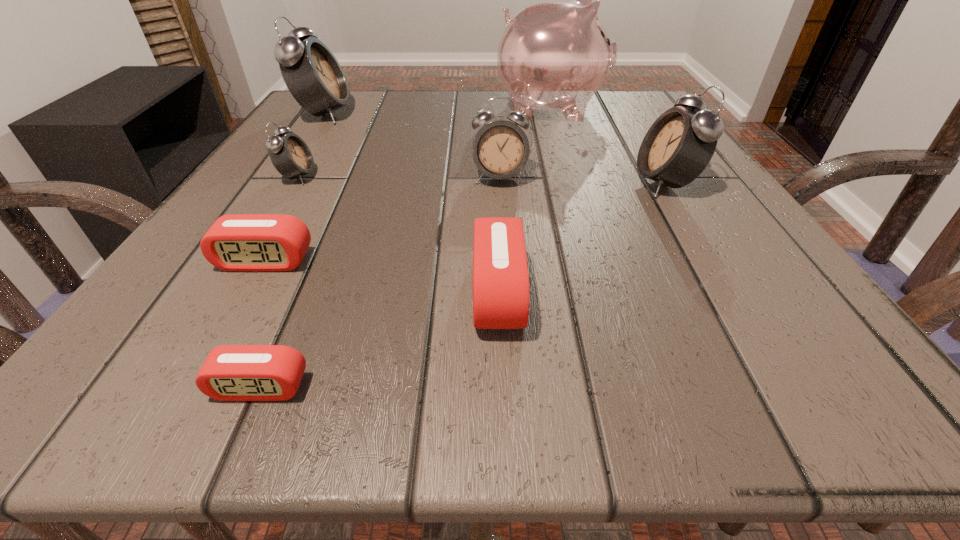
At what (x,y) coordinates should I click in order to perform the action: click on free space between the second shortest alarm clock and the nearest alarm clock. Please return your answer as a coordinate pair (x, y). This screenshot has height=540, width=960. Looking at the image, I should click on (262, 324).

What are the coordinates of `empty space that is in between the biggest white alarm clock and the fourth shortest object` in the screenshot? It's located at (311, 145).

Image resolution: width=960 pixels, height=540 pixels. I want to click on vacant space that is in between the fourth tallest alarm clock and the rightmost white alarm clock, so click(481, 180).

At what (x,y) coordinates should I click in order to perform the action: click on unoccupied position between the sixth shortest alarm clock and the third shortest object. Please return your answer as a coordinate pair (x, y). This screenshot has height=540, width=960. Looking at the image, I should click on (581, 238).

Identify the location of vacant area that lies between the shortest object and the rightmost pink alarm clock. The height and width of the screenshot is (540, 960). (379, 340).

What are the coordinates of `vacant point located between the fourth shortest alarm clock and the farthest white alarm clock` in the screenshot? It's located at (311, 145).

Locate an element on the screen. object that is the fifth closest to the second smallest pink alarm clock is located at coordinates (314, 77).

Find the location of a particular element. object that is the fourth nearest to the farthest alarm clock is located at coordinates (241, 242).

In order to click on alarm clock identified as the third closest to the fourth shortest alarm clock in this screenshot , I will do `click(500, 150)`.

Choose which alarm clock is the third nearest neighbor to the fifth tallest alarm clock. Please provide its 2D coordinates. Your answer should be formatted as a tuple, i.e. [(x, y)], where the tuple contains the x and y coordinates of a point satisfying the conditions above.

[(241, 242)]